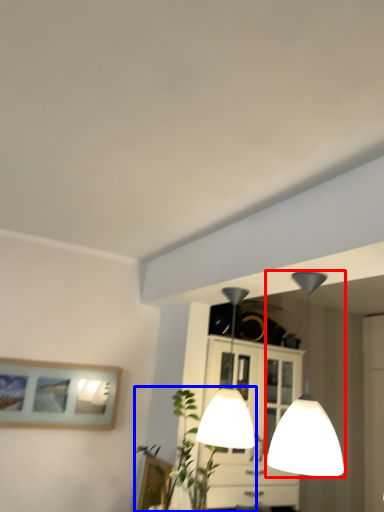
Question: Which object appears closest to the camera in this image, lamp (highlighted by a red box) or plant (highlighted by a blue box)?

Choices:
 (A) lamp
 (B) plant

Answer: (A)